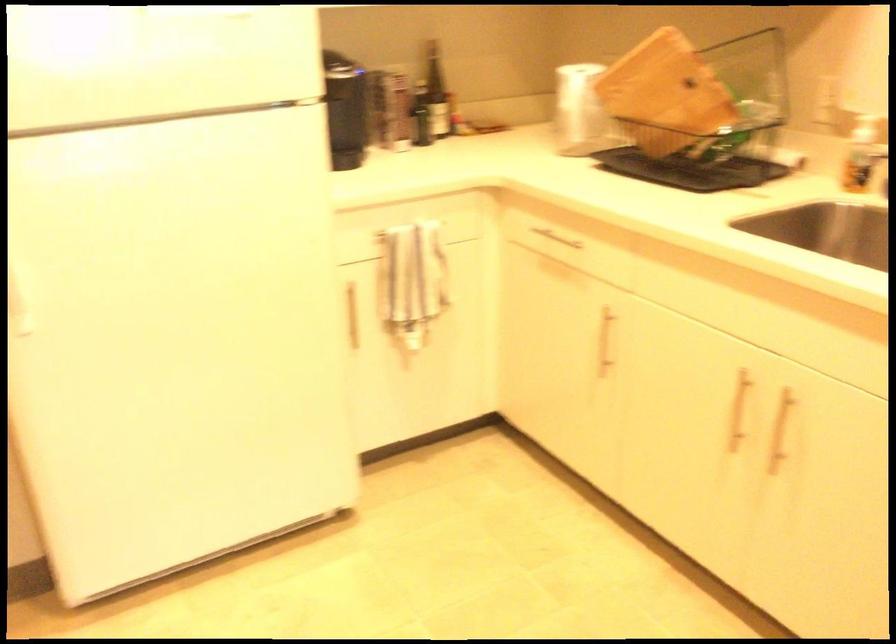
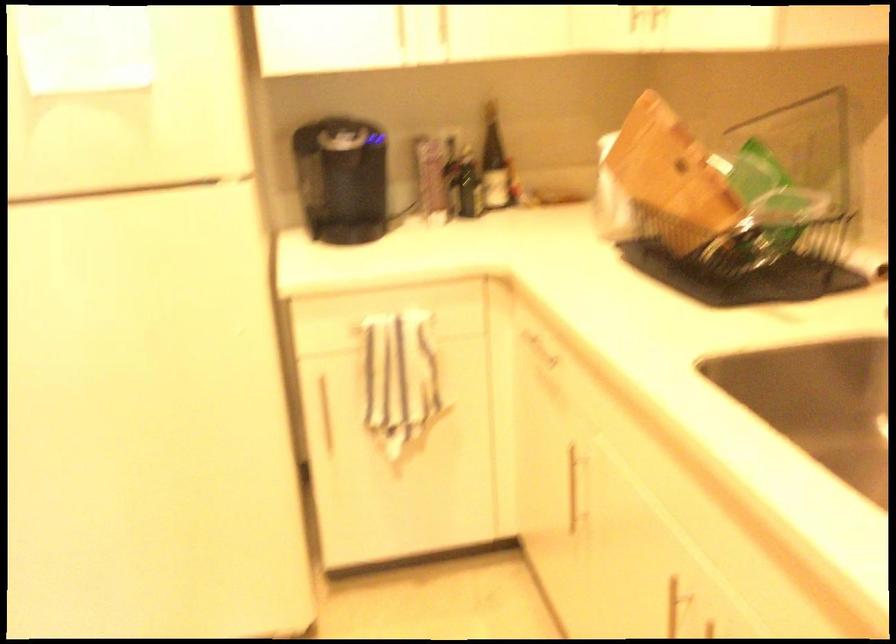
The point at (x=668, y=82) is marked in the first image. Where is the corresponding point in the second image?

(670, 167)